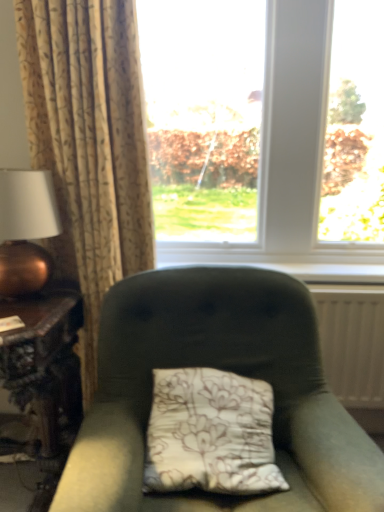
Question: Does beige floral fabric curtain at left have a greater height compared to velvet green chair at center?

Choices:
 (A) no
 (B) yes

Answer: (B)

Question: Does beige floral fabric curtain at left have a lesser height compared to velvet green chair at center?

Choices:
 (A) yes
 (B) no

Answer: (B)

Question: Does beige floral fabric curtain at left have a greater width compared to velvet green chair at center?

Choices:
 (A) yes
 (B) no

Answer: (B)

Question: From the image's perspective, would you say beige floral fabric curtain at left is shown under velvet green chair at center?

Choices:
 (A) no
 (B) yes

Answer: (A)

Question: From a real-world perspective, is beige floral fabric curtain at left under velvet green chair at center?

Choices:
 (A) yes
 (B) no

Answer: (B)

Question: Is velvet green chair at center completely or partially inside beige floral fabric curtain at left?

Choices:
 (A) no
 (B) yes

Answer: (A)

Question: Does copper metallic table lamp at left turn towards white textured radiator at right?

Choices:
 (A) yes
 (B) no

Answer: (B)

Question: Is copper metallic table lamp at left oriented away from white textured radiator at right?

Choices:
 (A) yes
 (B) no

Answer: (B)

Question: From the image's perspective, would you say copper metallic table lamp at left is positioned over white textured radiator at right?

Choices:
 (A) no
 (B) yes

Answer: (B)

Question: Does copper metallic table lamp at left have a larger size compared to white textured radiator at right?

Choices:
 (A) no
 (B) yes

Answer: (B)

Question: Is copper metallic table lamp at left far away from white textured radiator at right?

Choices:
 (A) yes
 (B) no

Answer: (A)

Question: Can you confirm if copper metallic table lamp at left is thinner than white textured radiator at right?

Choices:
 (A) yes
 (B) no

Answer: (B)

Question: Is beige floral fabric curtain at left taller than white painted wood at center?

Choices:
 (A) no
 (B) yes

Answer: (B)